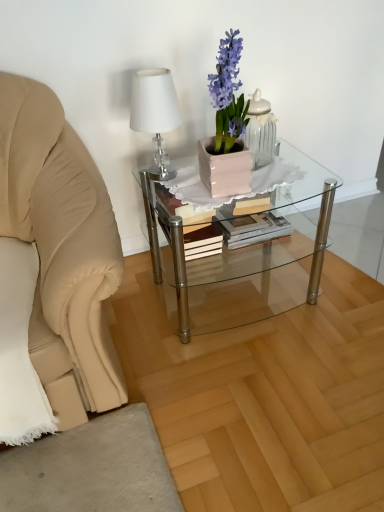
Question: Can you confirm if clear glass coffee table at center is positioned to the left of matte pink pot at center?

Choices:
 (A) no
 (B) yes

Answer: (A)

Question: Is clear glass coffee table at center facing towards matte pink pot at center?

Choices:
 (A) yes
 (B) no

Answer: (B)

Question: Would you say clear glass coffee table at center is outside matte pink pot at center?

Choices:
 (A) yes
 (B) no

Answer: (A)

Question: Is clear glass coffee table at center next to matte pink pot at center?

Choices:
 (A) no
 (B) yes

Answer: (A)

Question: Is clear glass coffee table at center positioned with its back to matte pink pot at center?

Choices:
 (A) no
 (B) yes

Answer: (A)

Question: Is point (203, 154) positioned closer to the camera than point (160, 92)?

Choices:
 (A) farther
 (B) closer

Answer: (A)

Question: From the image's perspective, is matte pink pot at center above or below white glossy table lamp at upper left?

Choices:
 (A) below
 (B) above

Answer: (B)

Question: Is matte pink pot at center situated inside white glossy table lamp at upper left or outside?

Choices:
 (A) inside
 (B) outside

Answer: (B)

Question: In the image, is matte pink pot at center positioned in front of or behind white glossy table lamp at upper left?

Choices:
 (A) behind
 (B) front

Answer: (B)

Question: Choose the correct answer: Is white glossy table lamp at upper left inside white glossy jar at upper center or outside it?

Choices:
 (A) inside
 (B) outside

Answer: (B)

Question: Considering the relative positions of white glossy table lamp at upper left and white glossy jar at upper center in the image provided, is white glossy table lamp at upper left to the left or to the right of white glossy jar at upper center?

Choices:
 (A) left
 (B) right

Answer: (A)

Question: From a real-world perspective, relative to white glossy jar at upper center, is white glossy table lamp at upper left vertically above or below?

Choices:
 (A) below
 (B) above

Answer: (B)

Question: Considering the positions of point pos(170,117) and point pos(274,132), is point pos(170,117) closer or farther from the camera than point pos(274,132)?

Choices:
 (A) closer
 (B) farther

Answer: (A)

Question: Is white glossy jar at upper center bigger or smaller than hardcover book at center?

Choices:
 (A) small
 (B) big

Answer: (A)

Question: From a real-world perspective, is white glossy jar at upper center above or below hardcover book at center?

Choices:
 (A) above
 (B) below

Answer: (A)